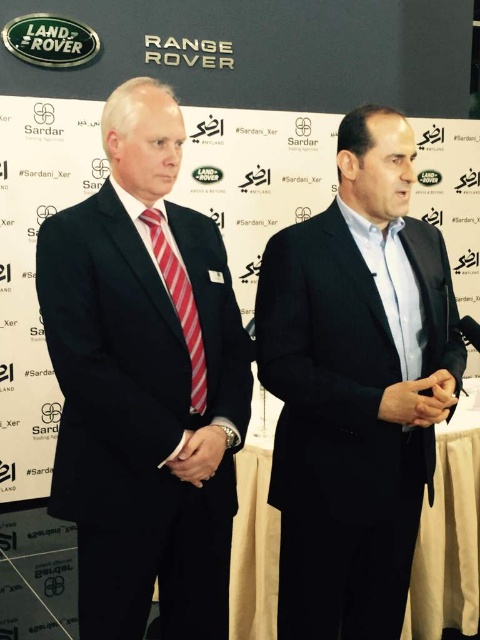
Question: Which of the following is the farthest from the observer?

Choices:
 (A) (322, 620)
 (B) (203, 355)
 (C) (129, 275)

Answer: (A)

Question: Does black matte suit at center appear under red striped tie at center?

Choices:
 (A) no
 (B) yes

Answer: (B)

Question: Which of the following is the farthest from the observer?

Choices:
 (A) red striped tie at center
 (B) black matte suit at left
 (C) black matte suit at center

Answer: (A)

Question: Can you confirm if black matte suit at left is positioned below black matte suit at center?

Choices:
 (A) no
 (B) yes

Answer: (A)

Question: Can you confirm if black matte suit at left is positioned above red striped tie at center?

Choices:
 (A) yes
 (B) no

Answer: (B)

Question: Which object appears closest to the camera in this image?

Choices:
 (A) black matte suit at center
 (B) black matte suit at left
 (C) red striped tie at center

Answer: (B)